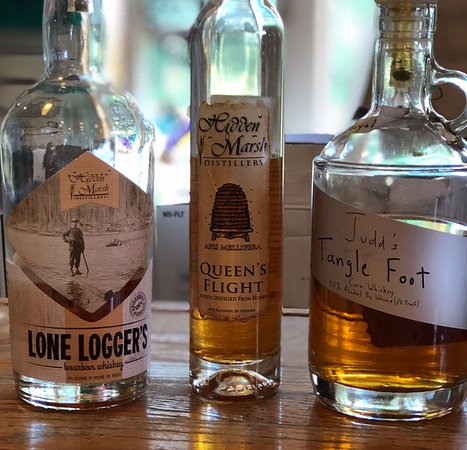
At what (x,y) coordinates should I click in order to perform the action: click on judd's tangle foot bottle. Please return your answer as a coordinate pair (x, y). This screenshot has width=467, height=450. Looking at the image, I should click on (417, 141).